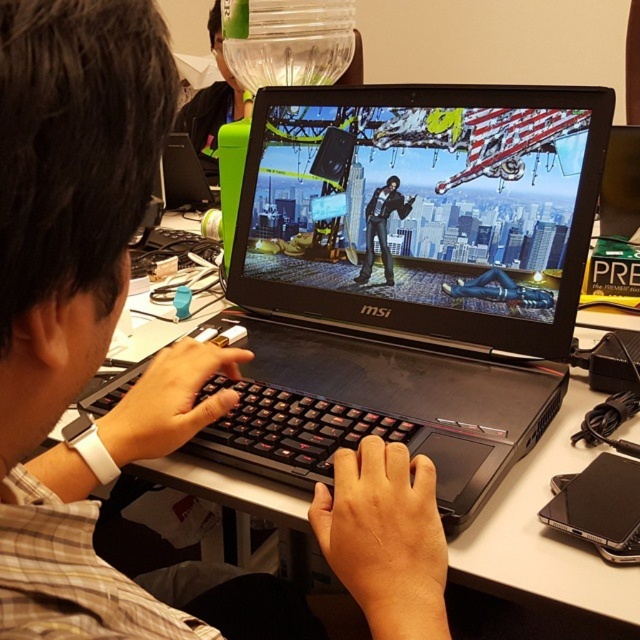
You are organizing your desk and need to place both the black matte keyboard at center and the black matte jacket at center. Which object should you move first if you want to place the taller one closer to the edge?

The black matte keyboard at center is taller than the black matte jacket at center, so you should move the black matte keyboard at center first to place it closer to the edge.

You are a delivery person who needs to place a package on the white plastic table at center. According to the image, where exactly should you place it?

The white plastic table at center is located at point (545, 538), so place the package there.

From the picture: You are a delivery person who needs to place a small package on the desk. The white plastic table at center is where you need to put it. However, there is a green plastic water bottle at upper center in the way. Based on their positions, can you move the water bottle to the left to make space?

The white plastic table at center is to the right of the green plastic water bottle at upper center. Since the table is already to the right, moving the water bottle further left would create space on the right side of the table, allowing you to place the package there.